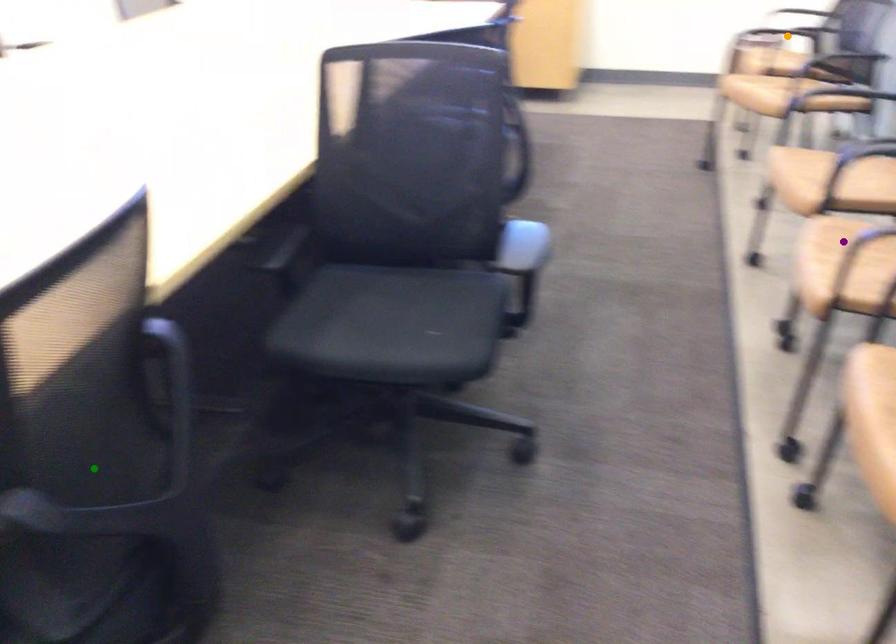
Order these from nearest to farthest:
A) orange point
B) purple point
C) green point

green point
purple point
orange point